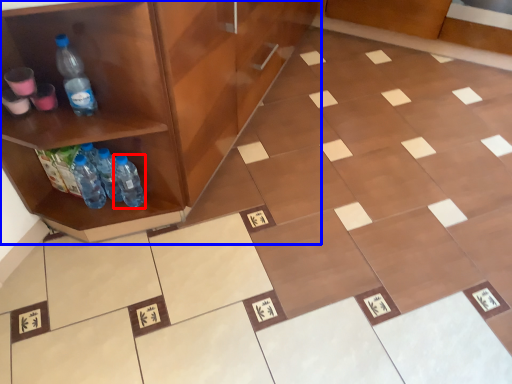
Question: Which object is further to the camera taking this photo, bottle (highlighted by a red box) or cabinetry (highlighted by a blue box)?

Choices:
 (A) bottle
 (B) cabinetry

Answer: (A)